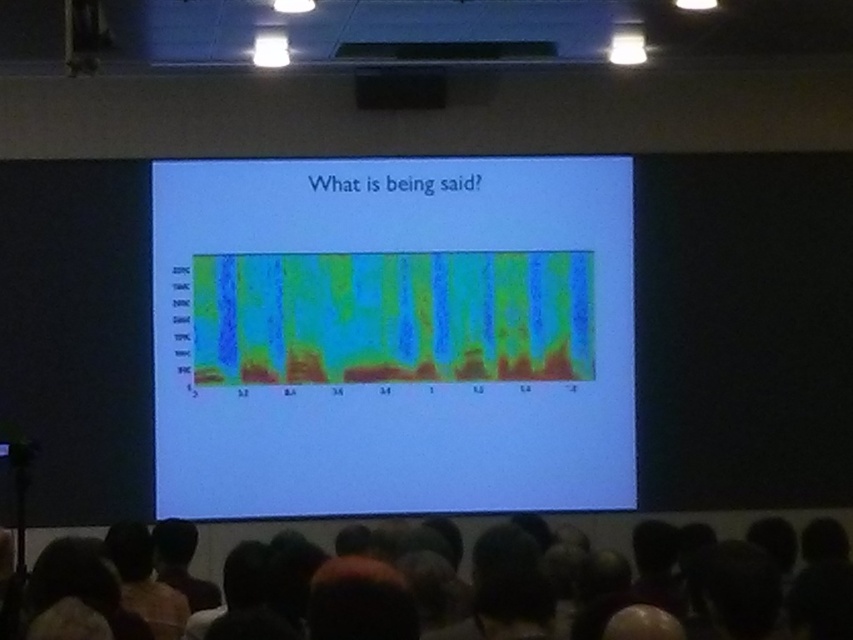
You are an attendee at the presentation. You notice two items in the room. One is the dark hair at lower center and the other is the black matte speaker at upper center. Which of these two items has a smaller width?

The dark hair at lower center has a smaller width than the black matte speaker at upper center because the dark hair at lower center is thinner than black matte speaker at upper center.

You are an attendee in the lecture hall and want to take a photo of the green gradient heatmap at center. Where should you aim your camera to capture it accurately?

The green gradient heatmap at center is located at the 2D coordinates point (392, 336), so aim your camera there to capture it accurately.